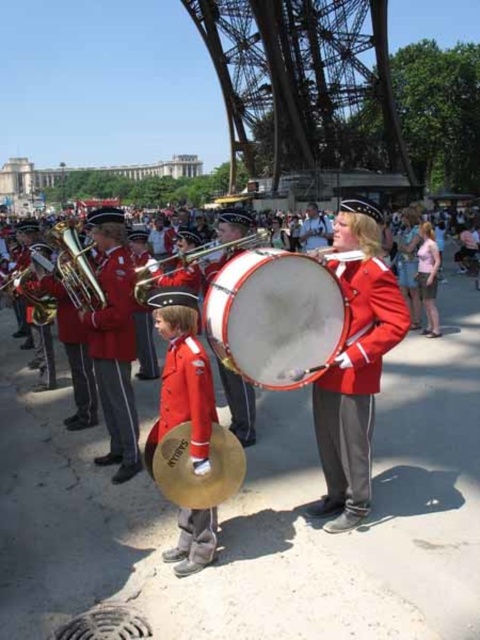
Which is more to the right, brass cymbal at center or shiny silver drum at center?

shiny silver drum at center is more to the right.

You are a GUI agent. You are given a task and a screenshot of the screen. Output one action in this format:
    pyautogui.click(x=<x>, y=<y>)
    Task: Click on the brass cymbal at center
    The image size is (480, 640).
    Given the screenshot: What is the action you would take?
    pyautogui.click(x=192, y=467)

Between point (186, 481) and point (196, 257), which one is positioned behind?

Point (196, 257)

I want to click on brass cymbal at center, so click(x=192, y=467).

Does pink fabric shirt at center have a greater width compared to shiny silver drum at center?

No, pink fabric shirt at center is not wider than shiny silver drum at center.

At what (x,y) coordinates should I click in order to perform the action: click on pink fabric shirt at center. Please return your answer as a coordinate pair (x, y). Looking at the image, I should click on (429, 276).

Can you confirm if metallic structure at center is positioned above brushed metal tuba at left?

Yes.

Can you confirm if metallic structure at center is positioned below brushed metal tuba at left?

No, metallic structure at center is not below brushed metal tuba at left.

Does point (333, 100) come farther from viewer compared to point (29, 269)?

Yes.

Locate an element on the screen. metallic structure at center is located at coordinates (303, 83).